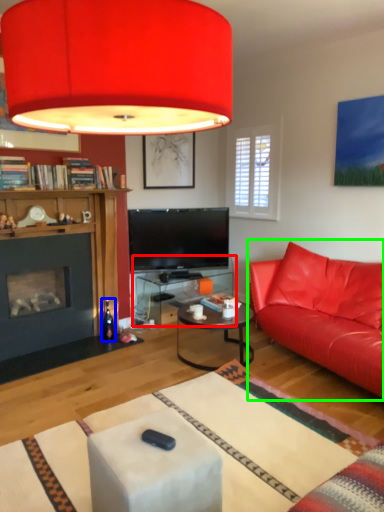
Question: Based on their relative distances, which object is nearer to table (highlighted by a red box)? Choose from wine bottle (highlighted by a blue box) and studio couch (highlighted by a green box).

Choices:
 (A) wine bottle
 (B) studio couch

Answer: (A)